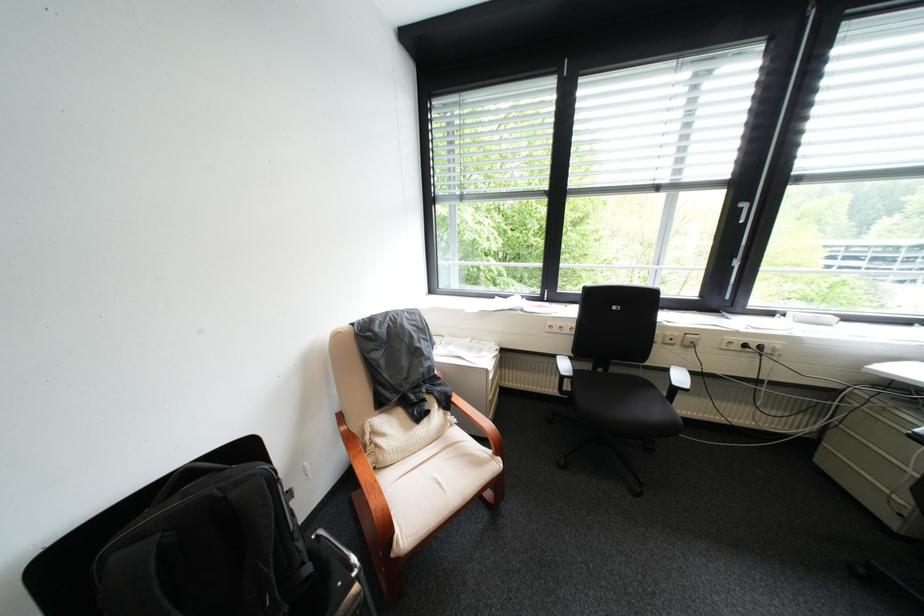
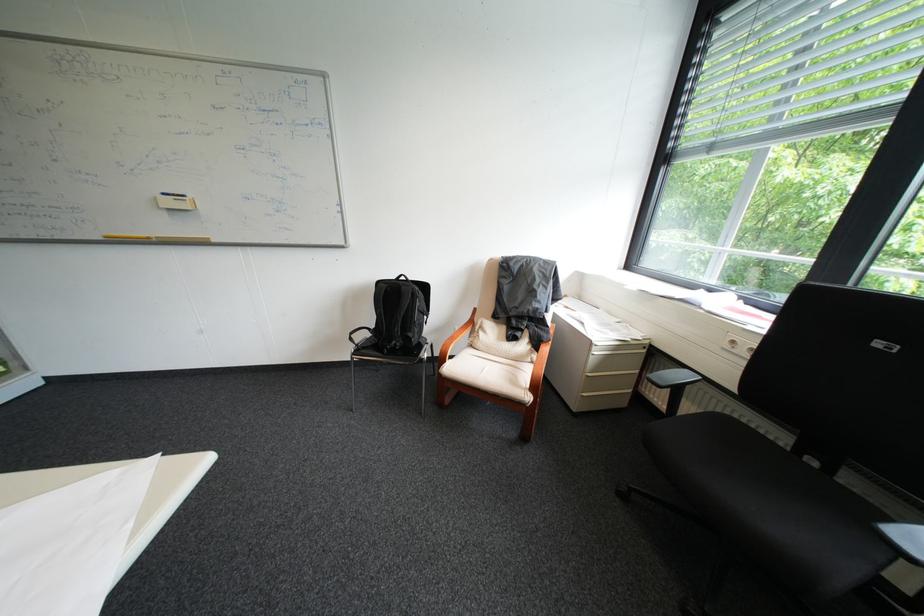
In the second image, find the point that corresponds to point 504,378 in the first image.

(609, 353)